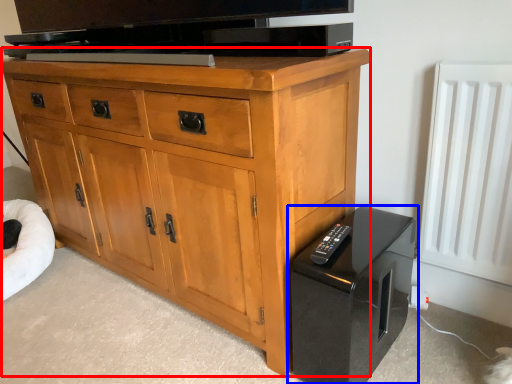
Question: Which of the following is the closest to the observer, chest of drawers (highlighted by a red box) or home appliance (highlighted by a blue box)?

Choices:
 (A) chest of drawers
 (B) home appliance

Answer: (A)